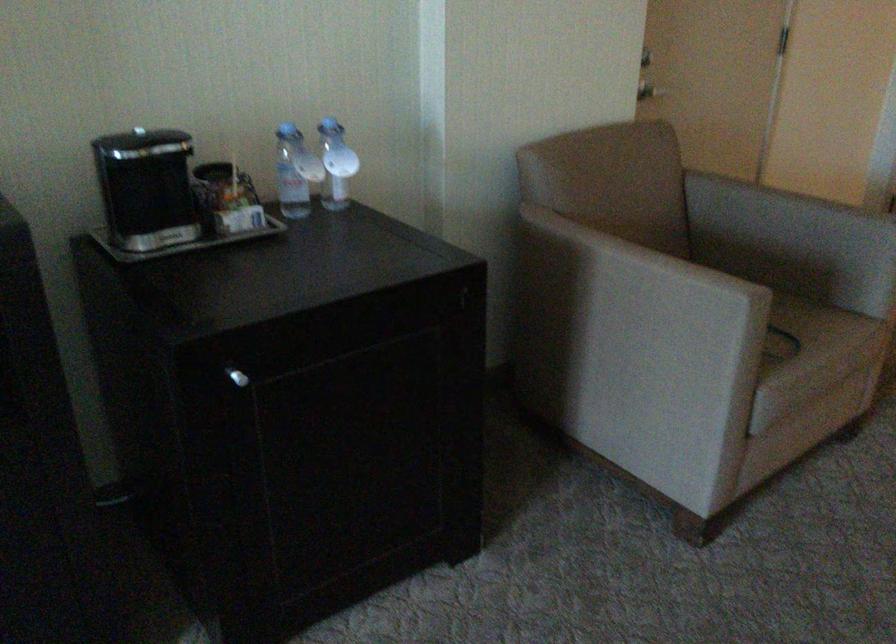
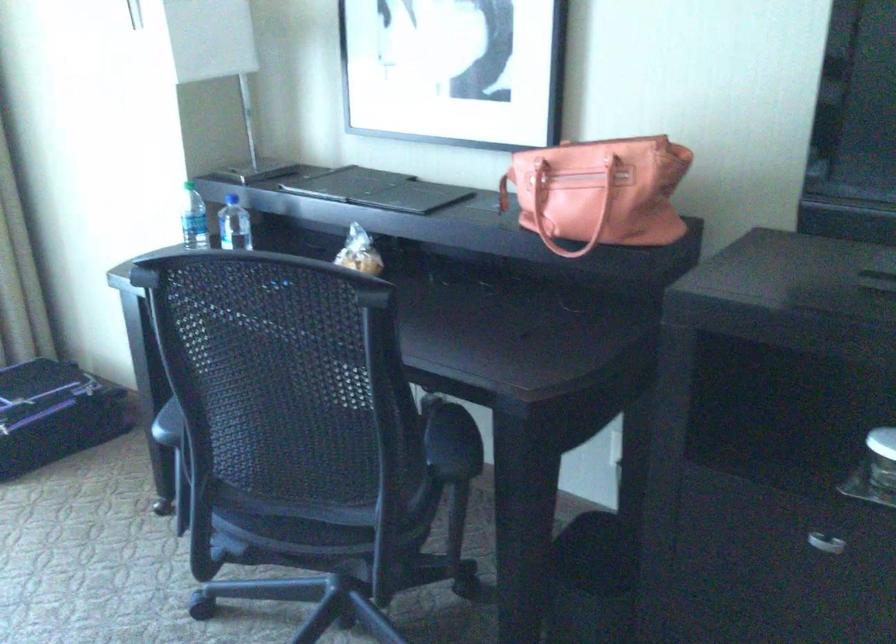
Question: Based on the continuous images, in which direction is the camera rotating? Reply with the corresponding letter.

Choices:
 (A) Left
 (B) Right
 (C) Up
 (D) Down

Answer: (A)